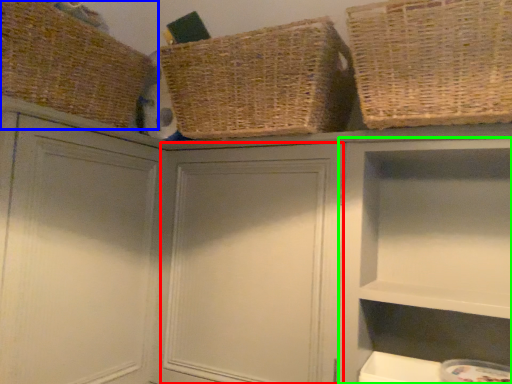
Question: Estimate the real-world distances between objects in this image. Which object is farther from cabinet (highlighted by a red box), basket (highlighted by a blue box) or cabinet (highlighted by a green box)?

Choices:
 (A) basket
 (B) cabinet

Answer: (A)